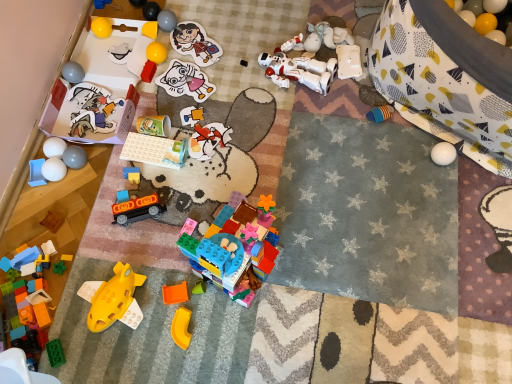
Locate an element on the screen. Image resolution: width=512 pixels, height=384 pixels. free space to the back side of orange matte train at center, which is the twelfth toy in right-to-left order is located at coordinates (146, 173).